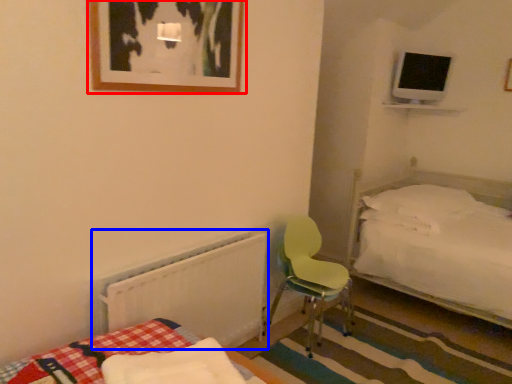
Question: Which point is further to the camera, picture frame (highlighted by a red box) or radiator (highlighted by a blue box)?

Choices:
 (A) picture frame
 (B) radiator

Answer: (B)